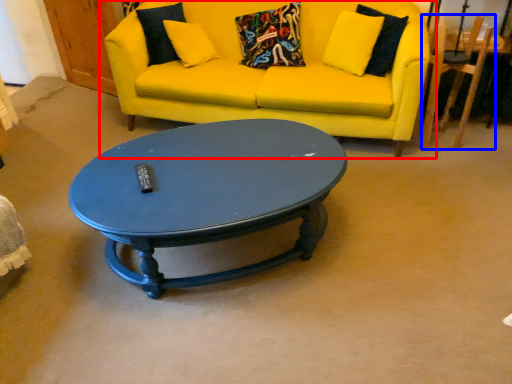
Question: Which object appears closest to the camera in this image, studio couch (highlighted by a red box) or armchair (highlighted by a blue box)?

Choices:
 (A) studio couch
 (B) armchair

Answer: (A)